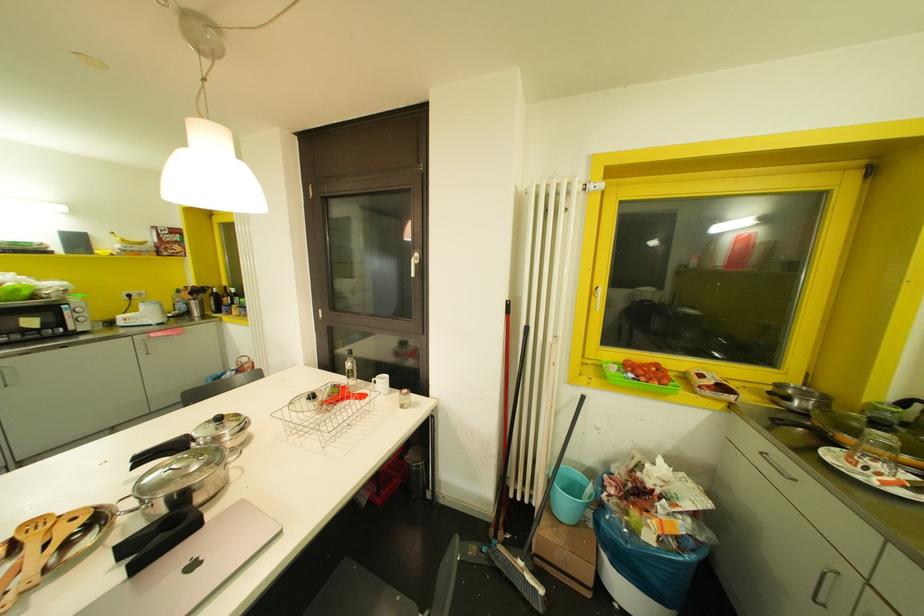
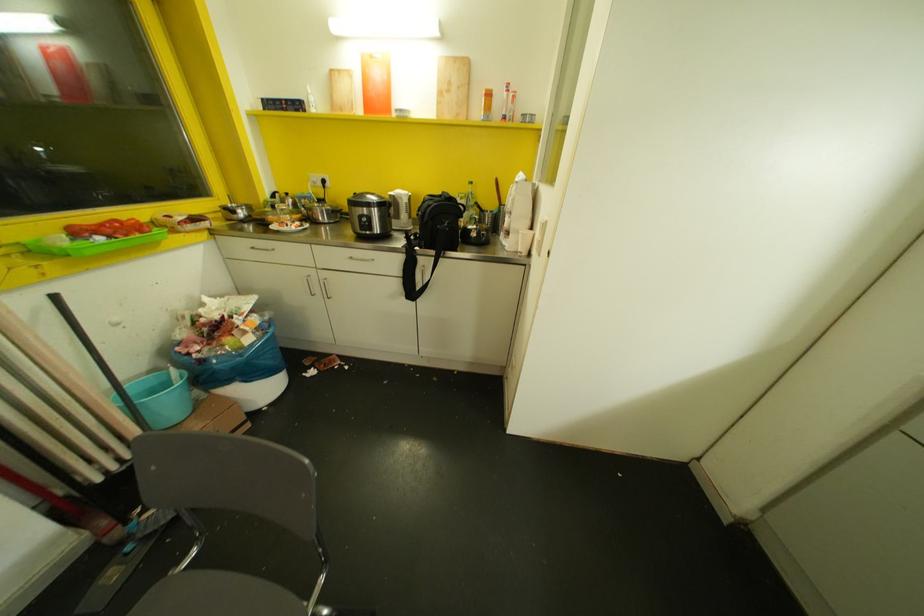
Where in the second image is the point corresponding to point 629,374 from the first image?

(99, 237)